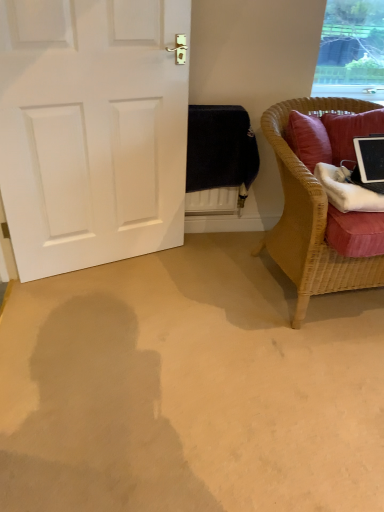
Question: Can you confirm if transparent glass window at upper right is wider than woven wicker chair at right?

Choices:
 (A) no
 (B) yes

Answer: (A)

Question: From the image's perspective, would you say transparent glass window at upper right is positioned over woven wicker chair at right?

Choices:
 (A) yes
 (B) no

Answer: (A)

Question: Can you confirm if transparent glass window at upper right is taller than woven wicker chair at right?

Choices:
 (A) yes
 (B) no

Answer: (B)

Question: Considering the relative sizes of transparent glass window at upper right and woven wicker chair at right in the image provided, is transparent glass window at upper right bigger than woven wicker chair at right?

Choices:
 (A) yes
 (B) no

Answer: (B)

Question: From a real-world perspective, does transparent glass window at upper right stand above woven wicker chair at right?

Choices:
 (A) yes
 (B) no

Answer: (A)

Question: Does transparent glass window at upper right have a lesser width compared to woven wicker chair at right?

Choices:
 (A) yes
 (B) no

Answer: (A)

Question: From the image's perspective, is black glossy tablet at right on white matte door at left?

Choices:
 (A) no
 (B) yes

Answer: (A)

Question: From a real-world perspective, is black glossy tablet at right physically below white matte door at left?

Choices:
 (A) yes
 (B) no

Answer: (B)

Question: Considering the relative sizes of black glossy tablet at right and white matte door at left in the image provided, is black glossy tablet at right thinner than white matte door at left?

Choices:
 (A) yes
 (B) no

Answer: (B)

Question: Considering the relative positions of black glossy tablet at right and white matte door at left in the image provided, is black glossy tablet at right in front of white matte door at left?

Choices:
 (A) no
 (B) yes

Answer: (A)

Question: Would you say black glossy tablet at right is outside white matte door at left?

Choices:
 (A) no
 (B) yes

Answer: (B)

Question: Can you confirm if black glossy tablet at right is bigger than white matte door at left?

Choices:
 (A) no
 (B) yes

Answer: (A)

Question: Considering the relative sizes of white matte door at left and woven wicker chair at right in the image provided, is white matte door at left smaller than woven wicker chair at right?

Choices:
 (A) no
 (B) yes

Answer: (B)